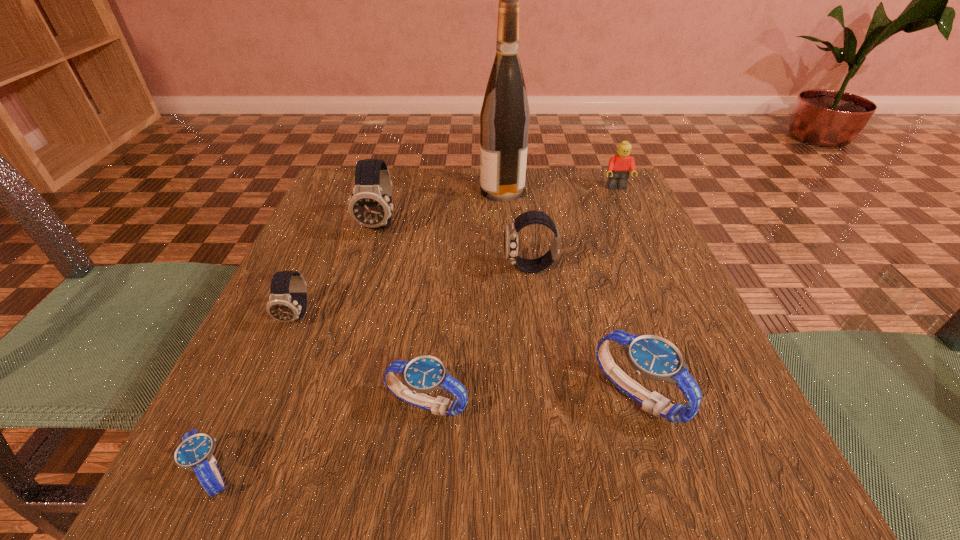
At what (x,y) coordinates should I click in order to perform the action: click on the fourth watch from left to right. Please return your answer as a coordinate pair (x, y). Looking at the image, I should click on (424, 374).

The image size is (960, 540). I want to click on the second shortest watch, so click(424, 374).

Find the location of `the leftmost blue watch`. the leftmost blue watch is located at coordinates (195, 451).

You are a GUI agent. You are given a task and a screenshot of the screen. Output one action in this format:
    pyautogui.click(x=<x>, y=<y>)
    Task: Click on the smallest blue watch
    
    Given the screenshot: What is the action you would take?
    pyautogui.click(x=195, y=451)

This screenshot has width=960, height=540. Identify the location of free spot located 0.290m on the left of the wine bottle. (361, 191).

The height and width of the screenshot is (540, 960). In order to click on vacant area situated 0.170m on the face of the farthest dark watch in this screenshot , I will do `click(358, 300)`.

Identify the location of free spot located 0.090m on the face of the second biggest dark watch. The height and width of the screenshot is (540, 960). (457, 268).

The width and height of the screenshot is (960, 540). What are the coordinates of `vacant space located on the face of the second biggest dark watch` in the screenshot? It's located at (399, 268).

Where is `vacant position located 0.050m on the face of the second biggest dark watch`? The image size is (960, 540). vacant position located 0.050m on the face of the second biggest dark watch is located at coordinates click(478, 268).

Where is `vacant space located on the face of the rightmost object`? This screenshot has height=540, width=960. vacant space located on the face of the rightmost object is located at coordinates (641, 241).